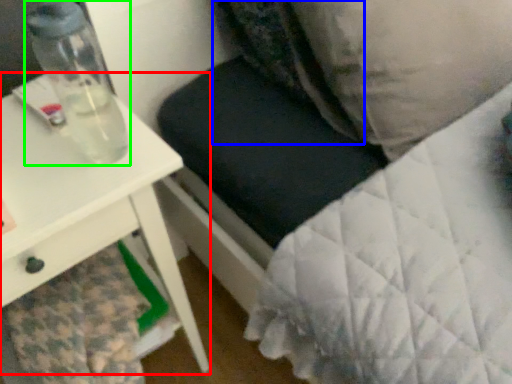
Question: Considering the real-world distances, which object is closest to table (highlighted by a red box)? pillow (highlighted by a blue box) or bottle (highlighted by a green box).

Choices:
 (A) pillow
 (B) bottle

Answer: (B)